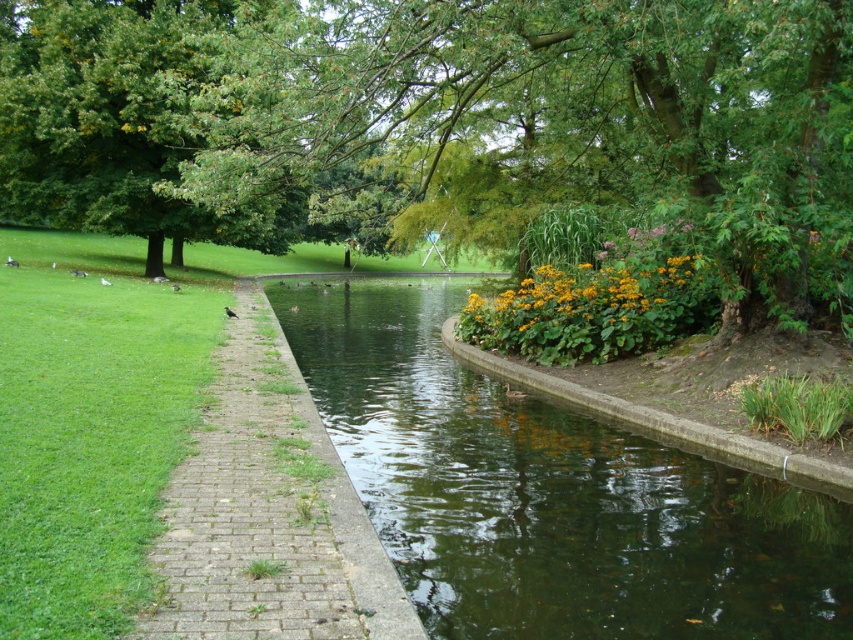
Which is more to the left, greenish water at center or brick at center?

brick at center is more to the left.

Is point (358, 476) farther from camera compared to point (265, 358)?

No, (358, 476) is closer to viewer.

What do you see at coordinates (550, 493) in the screenshot?
I see `greenish water at center` at bounding box center [550, 493].

The image size is (853, 640). Find the location of `greenish water at center`. greenish water at center is located at coordinates (550, 493).

Is green leafy tree at upper left thinner than brick at center?

No, green leafy tree at upper left is not thinner than brick at center.

Who is more forward, (x=772, y=273) or (x=213, y=387)?

Point (x=213, y=387)

Is point (379, 131) positioned in front of point (314, 424)?

No, (379, 131) is further to viewer.

Find the location of a particular element. This screenshot has height=640, width=853. green leafy tree at upper left is located at coordinates (550, 128).

In the scene shown: Is the position of brick at center less distant than that of yellow matte flowers at center?

That is True.

Based on the photo, which is above, brick at center or yellow matte flowers at center?

yellow matte flowers at center

Between point (305, 412) and point (457, 330), which one is positioned in front?

Point (305, 412) is in front.

Where is `brick at center`? brick at center is located at coordinates (258, 504).